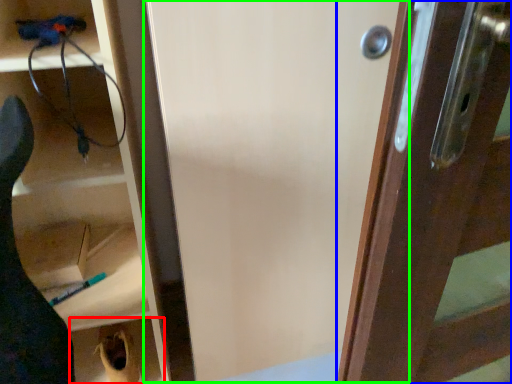
Question: Which object is the closest to the cabinetry (highlighted by a red box)? Choose among these: wood (highlighted by a blue box) or screen door (highlighted by a green box).

Choices:
 (A) wood
 (B) screen door

Answer: (B)